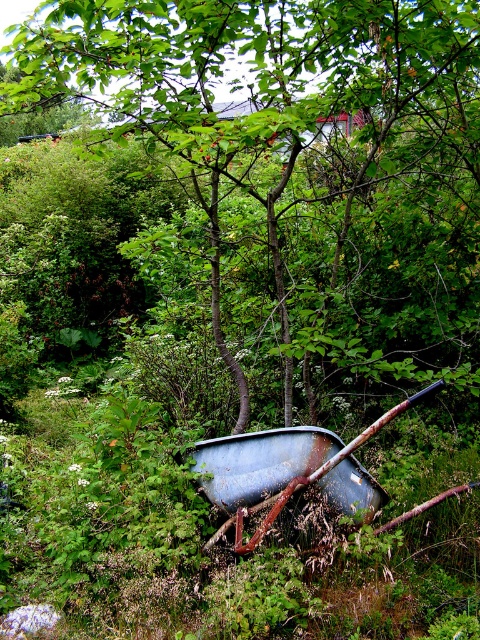
You are standing at the point marked by the coordinates point [300,156]. Looking around, you see dense greenery and a rusty wheelbarrow. Which direction should you walk to reach the green leafy tree at center?

The point [300,156] corresponds to the location of the green leafy tree at center, so you are already at the tree. There is no need to move.

You are standing in the middle of the scene and see the green leafy tree at center and the rusty metal wheelbarrow at center. Which object is positioned to the right side from your perspective?

The green leafy tree at center is positioned to the right of the rusty metal wheelbarrow at center, so the green leafy tree at center is on the right side.

From the picture: You are a gardener trying to reach the green leafy tree at center to prune its branches. The rusty metal wheelbarrow at center is in your way. Can you move the wheelbarrow to access the tree?

The green leafy tree at center is above the rusty metal wheelbarrow at center, so you can move the wheelbarrow since it is below the tree and not blocking the trunk directly.